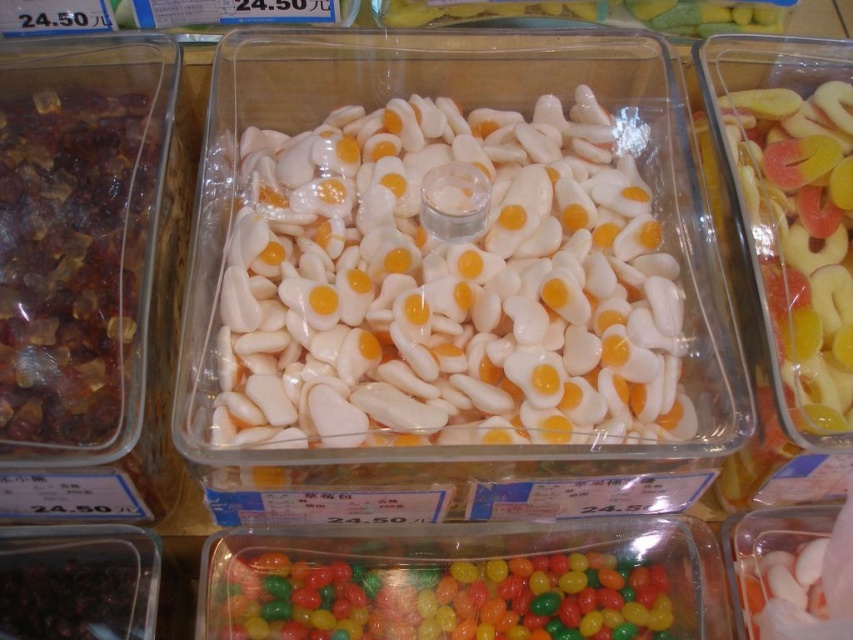
Question: Which object appears closest to the camera in this image?

Choices:
 (A) brown translucent gummy candies at left
 (B) glossy plastic jelly beans at lower center

Answer: (A)

Question: Among these points, which one is farthest from the camera?

Choices:
 (A) (636, 566)
 (B) (90, 253)

Answer: (A)

Question: Does brown translucent gummy candies at left have a smaller size compared to glossy plastic jelly beans at lower center?

Choices:
 (A) yes
 (B) no

Answer: (B)

Question: Does brown translucent gummy candies at left appear on the left side of glossy plastic jelly beans at lower center?

Choices:
 (A) no
 (B) yes

Answer: (B)

Question: Which object appears closest to the camera in this image?

Choices:
 (A) brown translucent gummy candies at left
 (B) glossy plastic jelly beans at lower center

Answer: (A)

Question: Can you confirm if brown translucent gummy candies at left is wider than glossy plastic jelly beans at lower center?

Choices:
 (A) yes
 (B) no

Answer: (B)